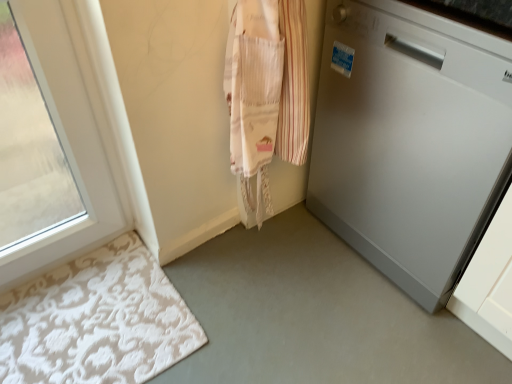
Question: Should I look upward or downward to see white textured bath mat at lower left?

Choices:
 (A) up
 (B) down

Answer: (B)

Question: Is white textured bath mat at lower left to the left of white glossy dishwasher at right from the viewer's perspective?

Choices:
 (A) no
 (B) yes

Answer: (B)

Question: Is white textured bath mat at lower left taller than white glossy dishwasher at right?

Choices:
 (A) yes
 (B) no

Answer: (B)

Question: Does white textured bath mat at lower left have a lesser height compared to white glossy dishwasher at right?

Choices:
 (A) yes
 (B) no

Answer: (A)

Question: Considering the relative sizes of white textured bath mat at lower left and white glossy dishwasher at right in the image provided, is white textured bath mat at lower left thinner than white glossy dishwasher at right?

Choices:
 (A) no
 (B) yes

Answer: (B)

Question: Is white textured bath mat at lower left oriented away from white glossy dishwasher at right?

Choices:
 (A) yes
 (B) no

Answer: (B)

Question: Is the depth of white textured bath mat at lower left greater than that of white glossy dishwasher at right?

Choices:
 (A) yes
 (B) no

Answer: (A)

Question: Can you confirm if white glossy dishwasher at right is taller than white textured bath mat at lower left?

Choices:
 (A) yes
 (B) no

Answer: (A)

Question: Does white glossy dishwasher at right appear on the left side of white textured bath mat at lower left?

Choices:
 (A) yes
 (B) no

Answer: (B)

Question: From the image's perspective, is white glossy dishwasher at right located beneath white textured bath mat at lower left?

Choices:
 (A) yes
 (B) no

Answer: (B)

Question: Is white glossy dishwasher at right in contact with white textured bath mat at lower left?

Choices:
 (A) yes
 (B) no

Answer: (B)

Question: Considering the relative sizes of white glossy dishwasher at right and white textured bath mat at lower left in the image provided, is white glossy dishwasher at right shorter than white textured bath mat at lower left?

Choices:
 (A) no
 (B) yes

Answer: (A)

Question: Is white glossy dishwasher at right further to the viewer compared to white textured bath mat at lower left?

Choices:
 (A) yes
 (B) no

Answer: (B)

Question: From the image's perspective, is white glossy dishwasher at right above or below white textured bath mat at lower left?

Choices:
 (A) below
 (B) above

Answer: (B)